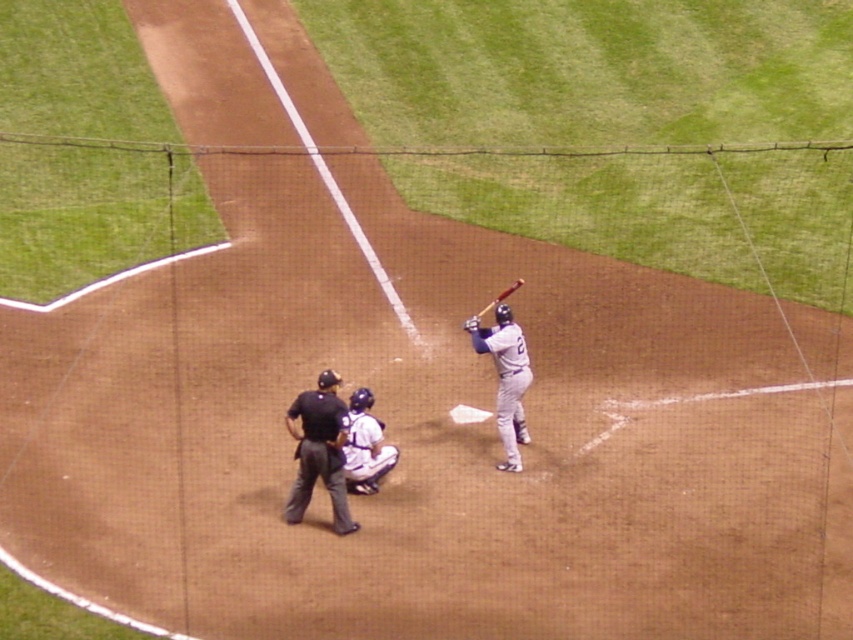
You are a photographer positioned behind the netting. You want to capture a clear shot of both the gray matte uniform at center and the wooden baseball bat at center. Can you see both objects fully without any obstruction from the netting?

The gray matte uniform at center is much taller than the wooden baseball bat at center, so the photographer can see both objects fully since the taller gray matte uniform at center would block the netting from obscuring the bat below it.

You are a spectator sitting behind the netting and want to see the batter clearly. Which object between the black fabric umpire at center and the gray matte uniform at center is shorter so you can look past it?

The black fabric umpire at center is shorter than the gray matte uniform at center, so you can look past the black fabric umpire at center to see the batter more clearly.

You are a drone operator tasked with capturing aerial footage of the baseball game. Your drone is currently positioned above the field and needs to fly between the black fabric umpire at center and the gray matte uniform at center to get a clear shot. Given that your drone has a wingspan of 3.5 feet, will it be able to safely navigate the space between them without hitting either?

The distance between the black fabric umpire at center and the gray matte uniform at center is 5.15 feet. Since the drone has a wingspan of 3.5 feet, it can safely navigate the space between them as the available distance is greater than the drone wingspan.